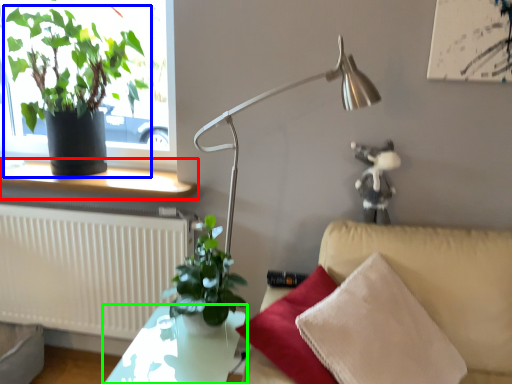
Question: Based on their relative distances, which object is farther from window sill (highlighted by a red box)? Choose from houseplant (highlighted by a blue box) and table (highlighted by a green box).

Choices:
 (A) houseplant
 (B) table

Answer: (B)